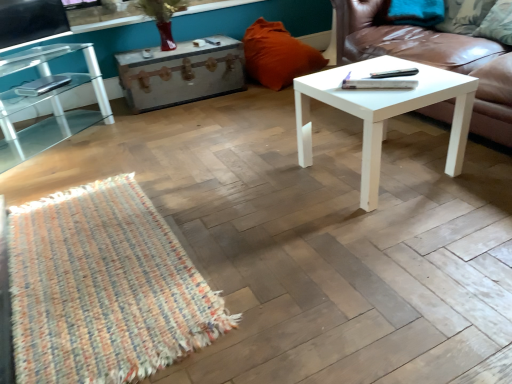
This screenshot has height=384, width=512. In order to click on empty space that is in between clear glass table at left and white matte coffee table at center in this screenshot , I will do `click(183, 163)`.